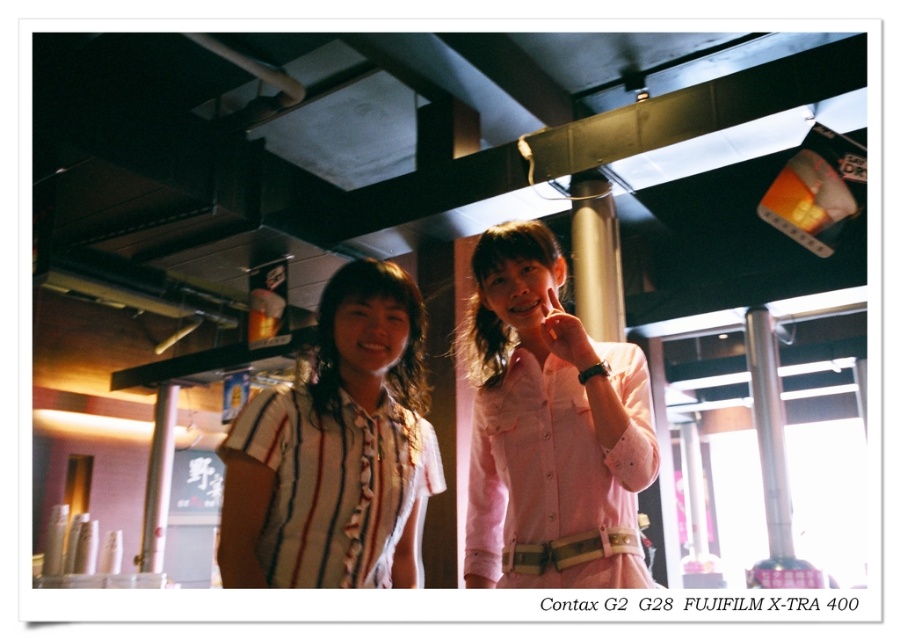
Is point (410, 292) farther from viewer compared to point (482, 355)?

No, (410, 292) is in front of (482, 355).

From the picture: Between striped cotton shirt at center and pink satin shirt at center, which one has less height?

striped cotton shirt at center

I want to click on striped cotton shirt at center, so click(x=551, y=429).

Who is more distant from viewer, (480,372) or (354,577)?

Positioned behind is point (480,372).

Can you confirm if pink satin shirt at center is positioned to the right of white striped fabric shirt at left?

Yes, pink satin shirt at center is to the right of white striped fabric shirt at left.

Is point (540, 323) positioned in front of point (387, 452)?

That is False.

The width and height of the screenshot is (900, 640). Find the location of `pink satin shirt at center`. pink satin shirt at center is located at coordinates (549, 429).

Is point (637, 465) closer to camera compared to point (303, 561)?

That is False.

Who is more distant from viewer, (x=555, y=496) or (x=324, y=413)?

Point (x=555, y=496)

Identify the location of striped cotton shirt at center. The image size is (900, 640). (551, 429).